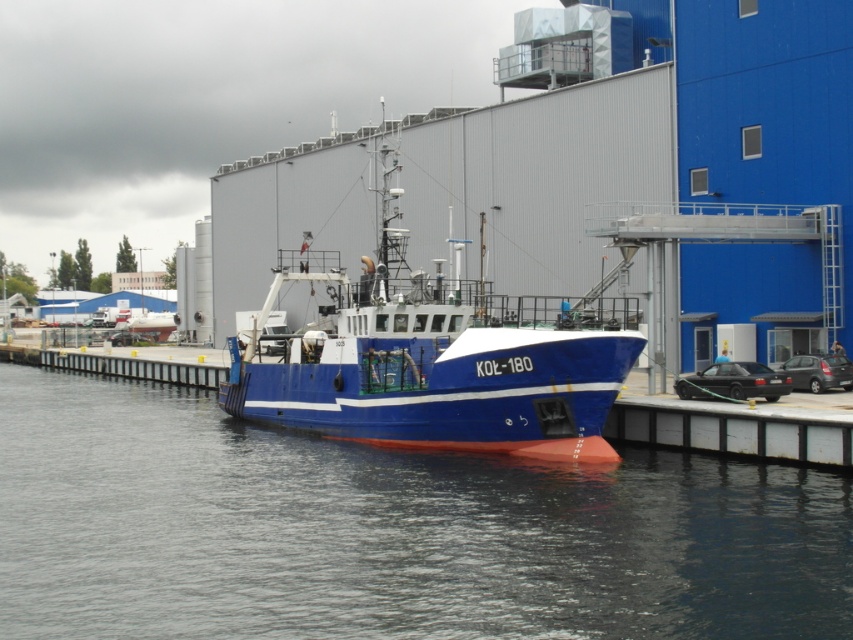
Question: Which point is closer to the camera?

Choices:
 (A) blue matte boat at center
 (B) blue glossy water at center

Answer: (B)

Question: Is blue glossy water at center to the right of blue matte boat at center from the viewer's perspective?

Choices:
 (A) no
 (B) yes

Answer: (B)

Question: Which of the following is the closest to the observer?

Choices:
 (A) blue matte boat at center
 (B) blue glossy water at center

Answer: (B)

Question: Is blue glossy water at center further to the viewer compared to blue matte boat at center?

Choices:
 (A) no
 (B) yes

Answer: (A)

Question: Can you confirm if blue glossy water at center is positioned to the right of blue matte boat at center?

Choices:
 (A) no
 (B) yes

Answer: (B)